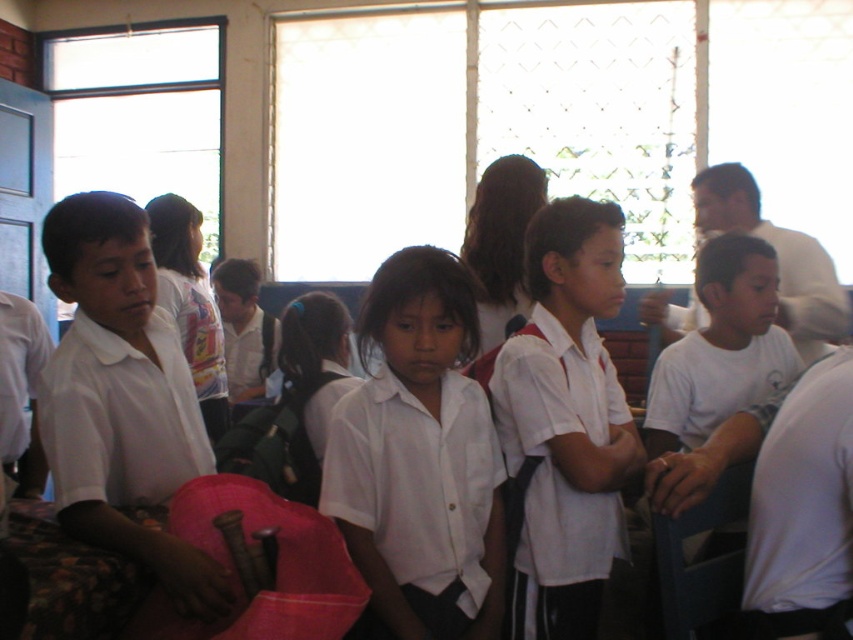
Between white matte shirt at center and white matte uniform shirt at left, which one appears on the right side from the viewer's perspective?

From the viewer's perspective, white matte shirt at center appears more on the right side.

Can you confirm if white matte shirt at center is thinner than white matte uniform shirt at left?

Yes.

Between point (461, 323) and point (190, 612), which one is positioned in front?

Point (190, 612)

In order to click on white matte shirt at center in this screenshot , I will do `click(421, 458)`.

Who is higher up, white matte shirt at center or matte white shirt at left?

matte white shirt at left is higher up.

Can you confirm if white matte shirt at center is thinner than matte white shirt at left?

No, white matte shirt at center is not thinner than matte white shirt at left.

The width and height of the screenshot is (853, 640). In order to click on white matte shirt at center in this screenshot , I will do `click(421, 458)`.

From the picture: Is white matte uniform shirt at center further to camera compared to white smooth shirt at right?

Yes, white matte uniform shirt at center is further from the viewer.

Does white matte uniform shirt at center appear on the right side of white smooth shirt at right?

Incorrect, white matte uniform shirt at center is not on the right side of white smooth shirt at right.

Does point (596, 465) lie behind point (816, 621)?

Yes, point (596, 465) is farther from viewer.

At what (x,y) coordinates should I click in order to perform the action: click on white matte uniform shirt at center. Please return your answer as a coordinate pair (x, y). This screenshot has height=640, width=853. Looking at the image, I should click on (566, 422).